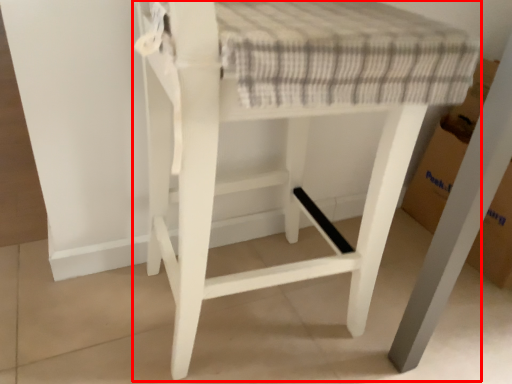
Question: From the image, what is the correct spatial relationship of furniture (annotated by the red box) in relation to cardboard box?

Choices:
 (A) left
 (B) right

Answer: (A)